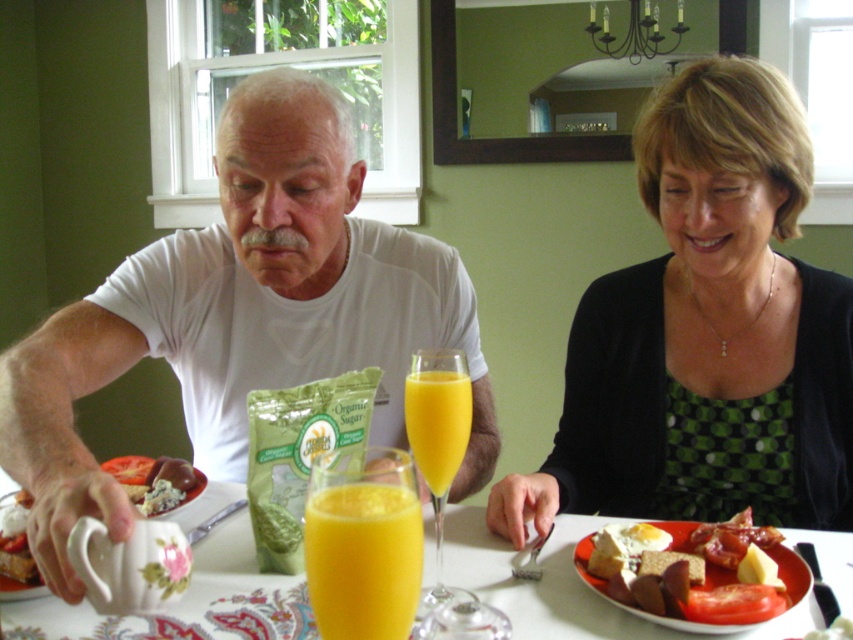
Question: Which point is closer to the camera?

Choices:
 (A) (578, 564)
 (B) (9, 525)
 (C) (15, 444)
 (D) (428, 400)

Answer: (D)

Question: Is white matte t-shirt at center positioned before yellow translucent glass at center?

Choices:
 (A) no
 (B) yes

Answer: (A)

Question: Is white matte t-shirt at center to the right of matte white creamer at lower left from the viewer's perspective?

Choices:
 (A) yes
 (B) no

Answer: (A)

Question: Does green dotted blouse at center come behind soft-boiled egg at center?

Choices:
 (A) no
 (B) yes

Answer: (B)

Question: Which point is farther to the camera?

Choices:
 (A) (436, 445)
 (B) (732, 576)
 (C) (22, 580)
 (D) (566, 548)

Answer: (D)

Question: Which point is closer to the camera?

Choices:
 (A) (103, 630)
 (B) (16, 502)
 (C) (699, 632)

Answer: (C)